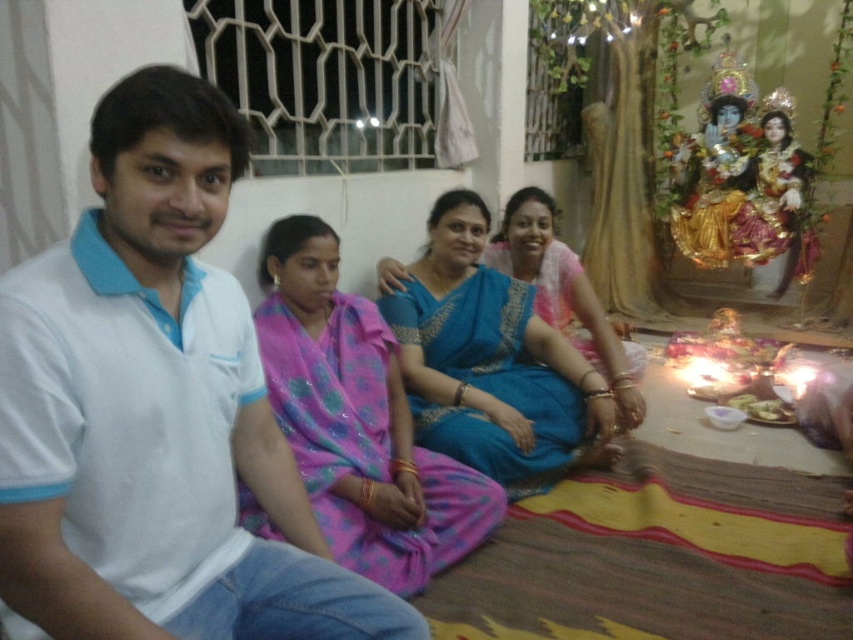
You are a photographer trying to capture a candid shot of the pink satin saree at center without including the white cotton shirt at left in the frame. Based on their positions, is this possible?

The white cotton shirt at left is in front of the pink satin saree at center, so it would block the view. Therefore, you cannot capture the pink satin saree at center without including the white cotton shirt at left in the frame.

You are a photographer trying to capture the pink satin saree at center and blue silk saree at center in the same frame. Based on their positions, which saree should you focus on first to ensure both are in the frame?

The pink satin saree at center is in front of the blue silk saree at center, so you should focus on the pink satin saree at center first to ensure both are in the frame.

From the picture: You are an event planner arranging seating for a cultural event. You notice the white cotton shirt at left and the pink satin saree at center. Based on their positions, which one is higher up in the image?

The white cotton shirt at left is located above the pink satin saree at center, so it is higher up in the image.